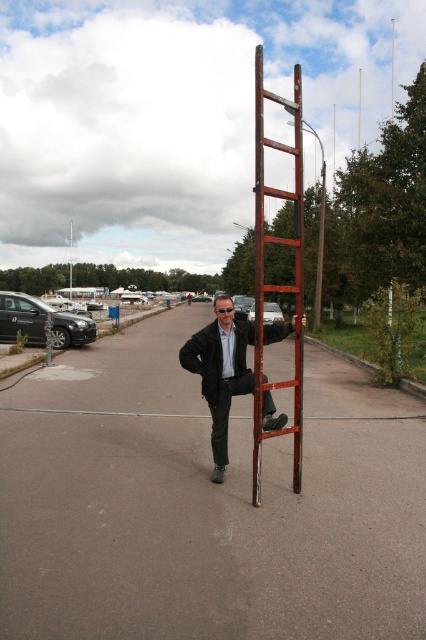
You are standing at the viewpoint of the image and want to determine which of the two points, point (296,237) or point (249,380), is nearer to you. Based on the scene description, which point is closer?

Point (296,237) is closer to the viewer than point (249,380).

You are standing at the point labeled as point (x=204, y=502) in the image. Looking around, you see a man on a ladder and a parking lot. What is the nearest object to you among the man on the tall red ladder and the metallic gray parking lot at center?

The point (x=204, y=502) corresponds to the metallic gray parking lot at center, so the nearest object to you is the metallic gray parking lot at center.